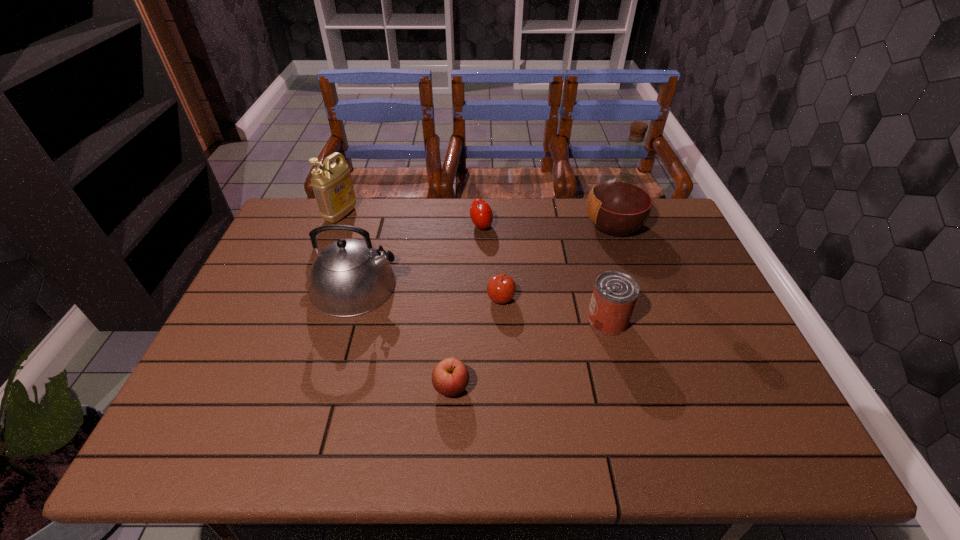
You are a GUI agent. You are given a task and a screenshot of the screen. Output one action in this format:
    pyautogui.click(x=<x>, y=<y>)
    Task: Click on the vacant space located on the front of the detergent
    The height and width of the screenshot is (540, 960).
    Given the screenshot: What is the action you would take?
    pyautogui.click(x=330, y=242)

Locate an element on the screen. The image size is (960, 540). vacant space positioned 0.150m from the spout of the kettle is located at coordinates (451, 286).

Identify the location of vacant space positioned 0.080m on the back of the fourth shortest object. (598, 285).

Where is `free space located 0.380m on the front of the farthest apple`? The image size is (960, 540). free space located 0.380m on the front of the farthest apple is located at coordinates (482, 326).

Identify the location of vacant space located on the front of the second nearest apple. Image resolution: width=960 pixels, height=540 pixels. (507, 429).

You are a GUI agent. You are given a task and a screenshot of the screen. Output one action in this format:
    pyautogui.click(x=<x>, y=<y>)
    Task: Click on the vacant space located on the back of the nearest apple
    The width and height of the screenshot is (960, 540).
    Given the screenshot: What is the action you would take?
    pyautogui.click(x=454, y=332)

You are a GUI agent. You are given a task and a screenshot of the screen. Output one action in this format:
    pyautogui.click(x=<x>, y=<y>)
    Task: Click on the liquor that is at the far edge
    Image resolution: width=960 pixels, height=540 pixels.
    Given the screenshot: What is the action you would take?
    pyautogui.click(x=618, y=205)

The width and height of the screenshot is (960, 540). What are the coordinates of `detergent situated at the far edge` in the screenshot? It's located at (332, 184).

You are a GUI agent. You are given a task and a screenshot of the screen. Output one action in this format:
    pyautogui.click(x=<x>, y=<y>)
    Task: Click on the apple at the far edge
    
    Given the screenshot: What is the action you would take?
    pyautogui.click(x=481, y=214)

What are the coordinates of `object situated at the left edge` in the screenshot? It's located at [332, 184].